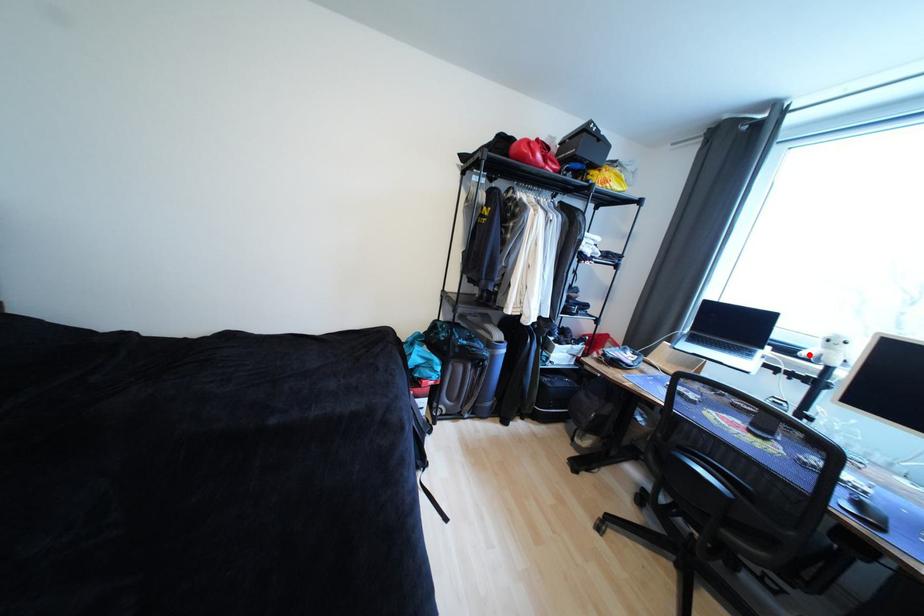
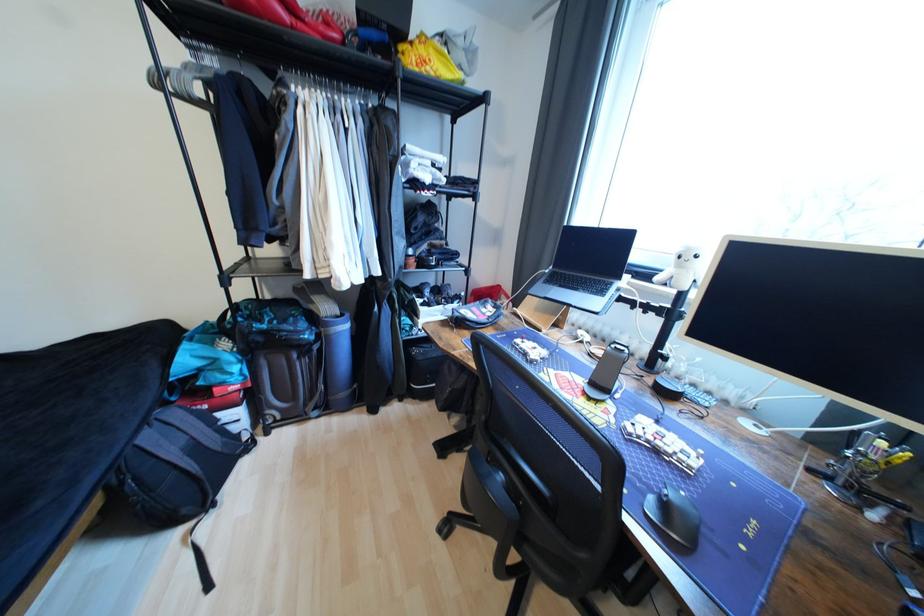
The point at the highlighted location is marked in the first image. Where is the corresponding point in the second image?

(663, 280)